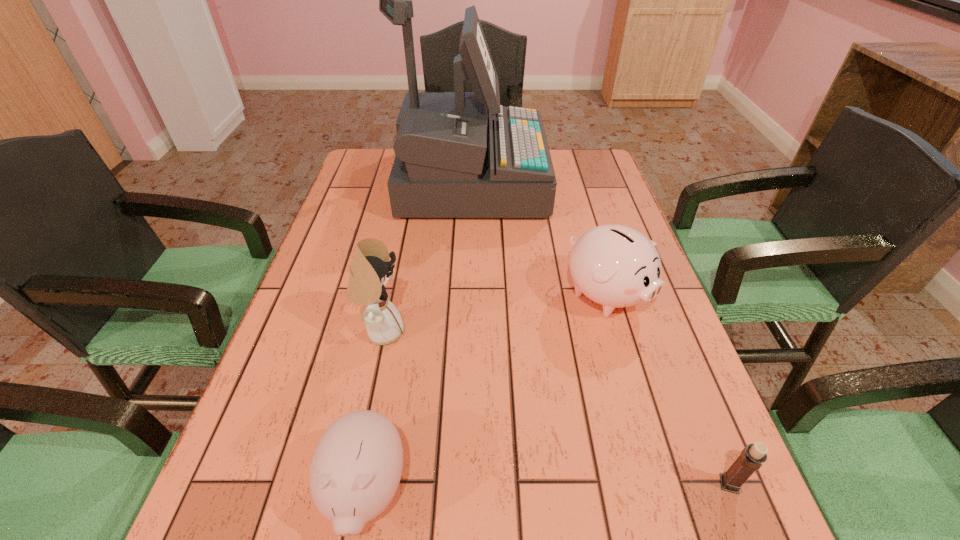
Where is `the farthest object`? Image resolution: width=960 pixels, height=540 pixels. the farthest object is located at coordinates (452, 160).

Locate an element on the screen. The height and width of the screenshot is (540, 960). cash register is located at coordinates (452, 160).

I want to click on the fourth shortest object, so click(370, 270).

At what (x,y) coordinates should I click in order to perform the action: click on the third shortest object. Please return your answer as a coordinate pair (x, y). Looking at the image, I should click on (616, 266).

Locate an element on the screen. Image resolution: width=960 pixels, height=540 pixels. the farther piggy bank is located at coordinates (616, 266).

At what (x,y) coordinates should I click in order to perform the action: click on candle holder. Please return your answer as a coordinate pair (x, y). Looking at the image, I should click on pos(751,458).

Locate an element on the screen. This screenshot has height=540, width=960. vacant region located 0.150m on the customer-facing side of the tallest object is located at coordinates (591, 181).

At what (x,y) coordinates should I click in order to perform the action: click on blank space located 0.160m at the front face of the second tallest object. Please return your answer as a coordinate pair (x, y). The width and height of the screenshot is (960, 540). Looking at the image, I should click on (479, 331).

This screenshot has width=960, height=540. In order to click on blank space located on the front of the right piggy bank in this screenshot , I will do `click(660, 480)`.

Find the location of `vacant space located on the back of the candle holder`. vacant space located on the back of the candle holder is located at coordinates (684, 373).